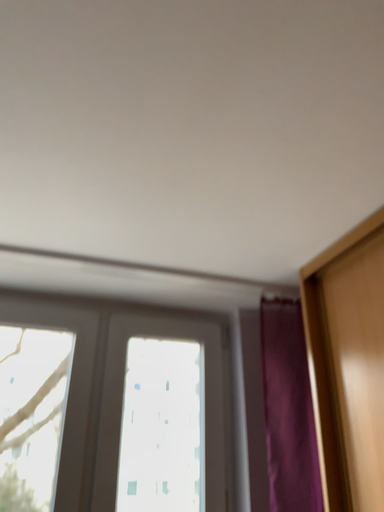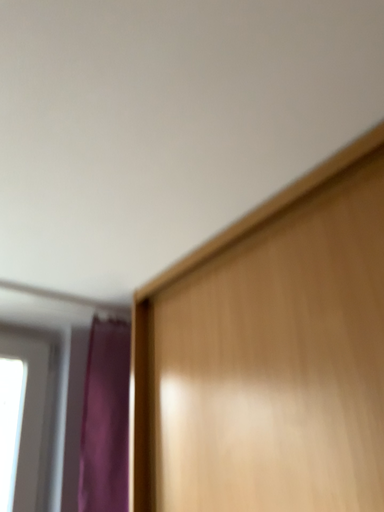
Question: Which way did the camera rotate in the video?

Choices:
 (A) rotated left
 (B) rotated right

Answer: (B)